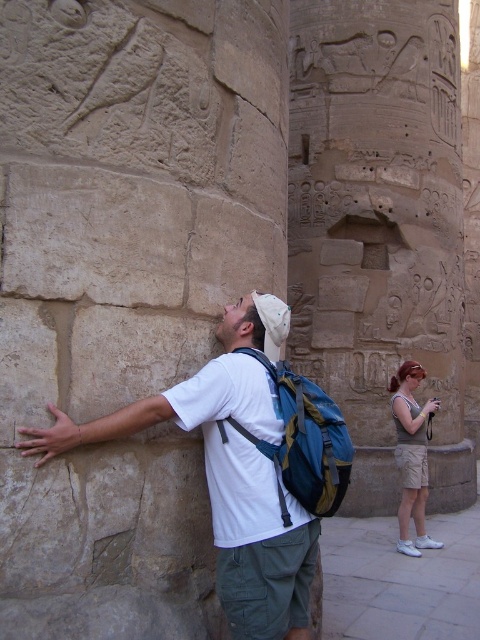
Question: Based on their relative distances, which object is nearer to the light brown cotton shorts at lower right?

Choices:
 (A) carved stone column at center
 (B) matte white t-shirt at center

Answer: (A)

Question: Considering the relative positions of carved stone column at center and light brown cotton shorts at lower right in the image provided, where is carved stone column at center located with respect to light brown cotton shorts at lower right?

Choices:
 (A) left
 (B) right

Answer: (B)

Question: Which point appears farthest from the camera in this image?

Choices:
 (A) (241, 620)
 (B) (304, 161)

Answer: (B)

Question: Considering the relative positions of matte white t-shirt at center and light brown cotton shorts at lower right in the image provided, where is matte white t-shirt at center located with respect to light brown cotton shorts at lower right?

Choices:
 (A) left
 (B) right

Answer: (A)

Question: Among these objects, which one is nearest to the camera?

Choices:
 (A) matte white t-shirt at center
 (B) light brown cotton shorts at lower right
 (C) carved stone column at center

Answer: (A)

Question: Is matte white t-shirt at center thinner than light brown cotton shorts at lower right?

Choices:
 (A) yes
 (B) no

Answer: (B)